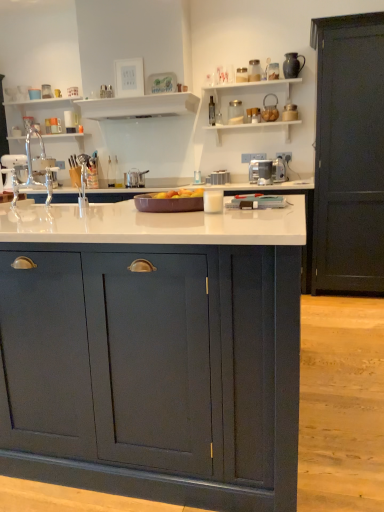
Question: Is metallic silver toaster at center, positioned as the 3th appliance in front-to-back order, smaller than white glossy shelf at upper center, marked as the 2th shelf in a left-to-right arrangement?

Choices:
 (A) yes
 (B) no

Answer: (A)

Question: Is metallic silver toaster at center, placed as the first appliance when sorted from back to front, facing towards white glossy shelf at upper center, which is counted as the 1th shelf, starting from the right?

Choices:
 (A) yes
 (B) no

Answer: (B)

Question: From the image's perspective, is metallic silver toaster at center, positioned as the 2th appliance in right-to-left order, over white glossy shelf at upper center, marked as the 2th shelf in a left-to-right arrangement?

Choices:
 (A) no
 (B) yes

Answer: (A)

Question: Is the position of metallic silver toaster at center, positioned as the 3th appliance in front-to-back order, less distant than that of white glossy shelf at upper center, which is counted as the 1th shelf, starting from the right?

Choices:
 (A) yes
 (B) no

Answer: (B)

Question: Does metallic silver toaster at center, positioned as the 3th appliance in front-to-back order, appear on the right side of white glossy shelf at upper center, which is counted as the 1th shelf, starting from the right?

Choices:
 (A) yes
 (B) no

Answer: (A)

Question: From a real-world perspective, is white glossy shelf at upper center, which is counted as the 1th shelf, starting from the right, above or below satin silver pot at center, acting as the 1th appliance starting from the left?

Choices:
 (A) above
 (B) below

Answer: (A)

Question: Considering the relative positions of white glossy shelf at upper center, marked as the 2th shelf in a left-to-right arrangement, and satin silver pot at center, which appears as the 3th appliance when viewed from the right, in the image provided, is white glossy shelf at upper center, marked as the 2th shelf in a left-to-right arrangement, to the left or to the right of satin silver pot at center, which appears as the 3th appliance when viewed from the right,?

Choices:
 (A) right
 (B) left

Answer: (B)

Question: Considering the positions of white glossy shelf at upper center, which is counted as the 1th shelf, starting from the right, and satin silver pot at center, arranged as the second appliance when viewed from the back, in the image, is white glossy shelf at upper center, which is counted as the 1th shelf, starting from the right, bigger or smaller than satin silver pot at center, arranged as the second appliance when viewed from the back,?

Choices:
 (A) big
 (B) small

Answer: (A)

Question: From the image's perspective, relative to satin silver pot at center, arranged as the second appliance when viewed from the back, is white glossy shelf at upper center, marked as the 2th shelf in a left-to-right arrangement, above or below?

Choices:
 (A) below
 (B) above

Answer: (B)

Question: Is point (97, 297) closer or farther from the camera than point (215, 180)?

Choices:
 (A) farther
 (B) closer

Answer: (B)

Question: Looking at their shapes, would you say matte dark blue cabinet at center, the first cabinetry when ordered from front to back, is wider or thinner than metallic silver toaster at center, positioned as the 2th appliance in left-to-right order?

Choices:
 (A) thin
 (B) wide

Answer: (B)

Question: From a real-world perspective, relative to metallic silver toaster at center, placed as the first appliance when sorted from back to front, is matte dark blue cabinet at center, the second cabinetry positioned from the right, vertically above or below?

Choices:
 (A) above
 (B) below

Answer: (B)

Question: From the image's perspective, is matte dark blue cabinet at center, the first cabinetry positioned from the left, located above or below metallic silver toaster at center, placed as the first appliance when sorted from back to front?

Choices:
 (A) below
 (B) above

Answer: (A)

Question: Relative to white glossy shelf at upper center, which is counted as the 1th shelf, starting from the right, is white glossy shelves at upper left, which is the first shelf in left-to-right order, in front or behind?

Choices:
 (A) front
 (B) behind

Answer: (B)

Question: Is white glossy shelves at upper left, which is the second shelf from right to left, situated inside white glossy shelf at upper center, marked as the 2th shelf in a left-to-right arrangement, or outside?

Choices:
 (A) inside
 (B) outside

Answer: (B)